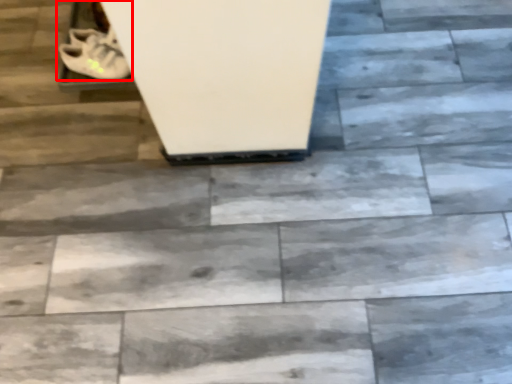
Question: Observing the image, what is the correct spatial positioning of footwear (annotated by the red box) in reference to shoe?

Choices:
 (A) left
 (B) right

Answer: (B)